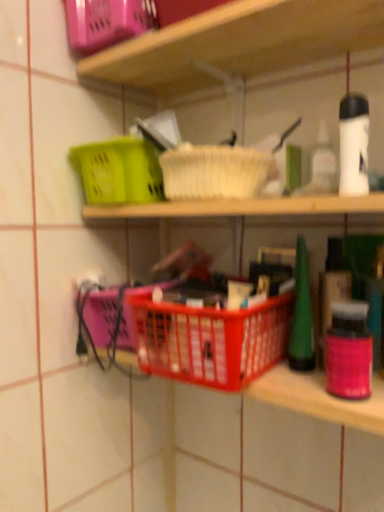
Measure the distance between point (343, 408) and camera.

The depth of point (343, 408) is 19.96 inches.

You are a GUI agent. You are given a task and a screenshot of the screen. Output one action in this format:
    pyautogui.click(x=<x>, y=<y>)
    Task: Click on the matte plastic basket at upper left
    The width and height of the screenshot is (384, 512).
    Given the screenshot: What is the action you would take?
    pyautogui.click(x=107, y=22)

Is red plastic basket at center positioned in front of matte plastic basket at upper left?

Yes.

From the image's perspective, is red plastic basket at center above or below matte plastic basket at upper left?

red plastic basket at center is below matte plastic basket at upper left.

The width and height of the screenshot is (384, 512). I want to click on basket that appears above the red plastic basket at center (from a real-world perspective), so click(x=107, y=22).

Which is farther, (97,214) or (241,338)?

The point (97,214) is behind.

Image resolution: width=384 pixels, height=512 pixels. I want to click on shelf above the red plastic basket at center (from the image's perspective), so click(239, 44).

Does plastic basket at center have a smaller size compared to red plastic basket at center?

No, plastic basket at center is not smaller than red plastic basket at center.

Which object is wider, plastic basket at center or red plastic basket at center?

red plastic basket at center.

From the image's perspective, relative to matte plastic basket at upper left, is plastic basket at center above or below?

plastic basket at center is situated lower than matte plastic basket at upper left in the image.

Which is less distant, [215,32] or [131,22]?

Point [215,32].

Consider the image. Between plastic basket at center and matte plastic basket at upper left, which one has smaller width?

matte plastic basket at upper left.

Is matte plastic basket at upper left bigger or smaller than red plastic basket at center?

In the image, matte plastic basket at upper left appears to be smaller than red plastic basket at center.

The image size is (384, 512). I want to click on basket that appears above the red plastic basket at center (from the image's perspective), so click(x=107, y=22).

How many degrees apart are the facing directions of matte plastic basket at upper left and red plastic basket at center?

The angle between the facing direction of matte plastic basket at upper left and the facing direction of red plastic basket at center is 0.000519 degrees.

Which object is more forward, matte plastic basket at upper left or red plastic basket at center?

red plastic basket at center is in front.

Considering the relative sizes of red plastic basket at center and plastic basket at center in the image provided, is red plastic basket at center thinner than plastic basket at center?

Incorrect, the width of red plastic basket at center is not less than that of plastic basket at center.

Does red plastic basket at center have a larger size compared to plastic basket at center?

Actually, red plastic basket at center might be smaller than plastic basket at center.

Between point (290, 298) and point (186, 68), which one is positioned in front?

Positioned in front is point (290, 298).

From the image's perspective, is matte plastic basket at upper left over plastic basket at center?

Yes, from the image's perspective, matte plastic basket at upper left is above plastic basket at center.

Which of these two, matte plastic basket at upper left or plastic basket at center, stands shorter?

matte plastic basket at upper left.

Considering the sizes of objects matte plastic basket at upper left and plastic basket at center in the image provided, who is wider, matte plastic basket at upper left or plastic basket at center?

With larger width is plastic basket at center.

From a real-world perspective, is matte plastic basket at upper left above or below plastic basket at center?

From a real-world perspective, matte plastic basket at upper left is physically above plastic basket at center.

The height and width of the screenshot is (512, 384). In the image, there is a matte plastic basket at upper left. What are the coordinates of `basket container below it (from the image's perspective)` in the screenshot? It's located at (211, 340).

You are a GUI agent. You are given a task and a screenshot of the screen. Output one action in this format:
    pyautogui.click(x=<x>, y=<y>)
    Task: Click on the basket container that appears on the right of plastic basket at center
    
    Given the screenshot: What is the action you would take?
    pyautogui.click(x=211, y=340)

From the image, which object appears to be nearer to red plastic basket at center, matte plastic basket at upper left or plastic basket at center?

Among the two, plastic basket at center is located nearer to red plastic basket at center.

Looking at the image, which one is located further to plastic basket at center, matte plastic basket at upper left or red plastic basket at center?

Among the two, red plastic basket at center is located further to plastic basket at center.

Considering their positions, is plastic basket at center positioned further to matte plastic basket at upper left than red plastic basket at center?

Among the two, red plastic basket at center is located further to matte plastic basket at upper left.

Which object lies further to the anchor point plastic basket at center, red plastic basket at center or matte plastic basket at upper left?

red plastic basket at center lies further to plastic basket at center than the other object.

When comparing their distances from matte plastic basket at upper left, does red plastic basket at center or plastic basket at center seem further?

red plastic basket at center lies further to matte plastic basket at upper left than the other object.

Based on their spatial positions, is plastic basket at center or matte plastic basket at upper left further from red plastic basket at center?

matte plastic basket at upper left.

Locate an element on the screen. Image resolution: width=384 pixels, height=512 pixels. shelf between matte plastic basket at upper left and red plastic basket at center in the up-down direction is located at coordinates click(239, 44).